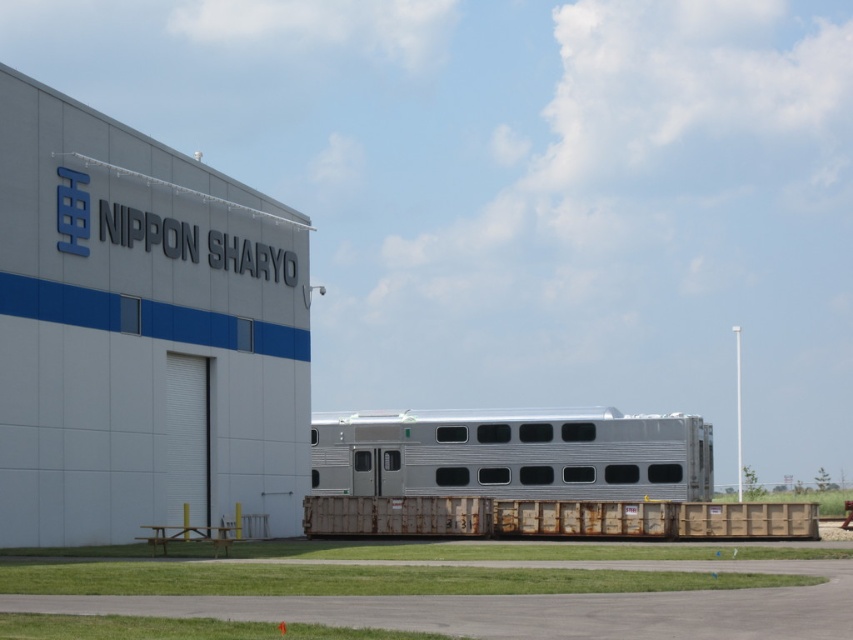
Does point (606, 436) come behind point (346, 500)?

Yes, point (606, 436) is behind point (346, 500).

Between silver/aluminum passenger train at center and brown wooden train at center, which one is positioned higher?

silver/aluminum passenger train at center is above.

Is point (315, 465) closer to camera compared to point (660, 506)?

No, it is not.

You are a GUI agent. You are given a task and a screenshot of the screen. Output one action in this format:
    pyautogui.click(x=<x>, y=<y>)
    Task: Click on the silver/aluminum passenger train at center
    Image resolution: width=853 pixels, height=640 pixels.
    Given the screenshot: What is the action you would take?
    pyautogui.click(x=514, y=454)

Can you confirm if gray matte building at upper left is smaller than silver/aluminum passenger train at center?

No.

Based on the photo, can you confirm if gray matte building at upper left is shorter than silver/aluminum passenger train at center?

In fact, gray matte building at upper left may be taller than silver/aluminum passenger train at center.

Between point (177, 225) and point (341, 422), which one is positioned behind?

The point (341, 422) is more distant.

I want to click on gray matte building at upper left, so click(141, 333).

What do you see at coordinates (141, 333) in the screenshot?
I see `gray matte building at upper left` at bounding box center [141, 333].

Does gray matte building at upper left have a smaller size compared to brown wooden train at center?

Actually, gray matte building at upper left might be larger than brown wooden train at center.

Does point (189, 244) come farther from viewer compared to point (485, 497)?

Yes.

Identify the location of gray matte building at upper left. The height and width of the screenshot is (640, 853). (141, 333).